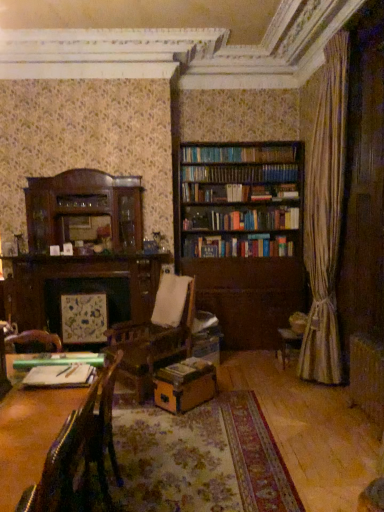
This screenshot has height=512, width=384. What do you see at coordinates (184, 385) in the screenshot?
I see `brown cardboard box at center` at bounding box center [184, 385].

Describe the element at coordinates (79, 455) in the screenshot. I see `leather-like dark brown chair at lower left, which is the 2th chair from front to back` at that location.

Image resolution: width=384 pixels, height=512 pixels. What do you see at coordinates (244, 234) in the screenshot?
I see `brown wooden bookcase at center` at bounding box center [244, 234].

This screenshot has width=384, height=512. Describe the element at coordinates (185, 371) in the screenshot. I see `wooden book at center, which is the second book from left to right` at that location.

Where is `wooden book at center, which ranks as the 2th book in front-to-back order`? This screenshot has width=384, height=512. wooden book at center, which ranks as the 2th book in front-to-back order is located at coordinates (185, 371).

Locate an element on the screen. leather cushioned chair at lower left, which ranks as the first chair in front-to-back order is located at coordinates pos(53,472).

The image size is (384, 512). What do you see at coordinates (53, 472) in the screenshot?
I see `leather cushioned chair at lower left, the second chair in the back-to-front sequence` at bounding box center [53, 472].

This screenshot has width=384, height=512. I want to click on brown cardboard box at center, so click(x=184, y=385).

Which object is thinner, green matte ruler at lower left, which is the second book in bottom-to-top order, or brown cardboard box at center?

With smaller width is green matte ruler at lower left, which is the second book in bottom-to-top order.

Does green matte ruler at lower left, marked as the 1th book in a left-to-right arrangement, appear on the left side of brown cardboard box at center?

Yes, green matte ruler at lower left, marked as the 1th book in a left-to-right arrangement, is to the left of brown cardboard box at center.

Is the depth of green matte ruler at lower left, the first book from the front, greater than that of brown cardboard box at center?

No.

Is brown cardboard box at center at the back of green matte ruler at lower left, positioned as the first book in top-to-bottom order?

That's not correct — green matte ruler at lower left, positioned as the first book in top-to-bottom order, is not looking away from brown cardboard box at center.

Relative to brown cardboard box at center, is wooden book at center, which is the first book from right to left, in front or behind?

In the image, wooden book at center, which is the first book from right to left, appears behind brown cardboard box at center.

Does wooden book at center, which ranks as the 2th book in front-to-back order, turn towards brown cardboard box at center?

No.

Between wooden book at center, which ranks as the 2th book in front-to-back order, and brown cardboard box at center, which one has smaller width?

With smaller width is wooden book at center, which ranks as the 2th book in front-to-back order.

From the image's perspective, relative to brown cardboard box at center, is wooden book at center, which appears as the 1th book when viewed from the back, above or below?

Based on their image positions, wooden book at center, which appears as the 1th book when viewed from the back, is located above brown cardboard box at center.

Can you confirm if brown wooden bookcase at center is positioned to the left of brown cardboard box at center?

In fact, brown wooden bookcase at center is to the right of brown cardboard box at center.

Considering the relative positions of brown wooden bookcase at center and brown cardboard box at center in the image provided, is brown wooden bookcase at center behind brown cardboard box at center?

Yes.

In the scene shown: Considering the sizes of objects brown wooden bookcase at center and brown cardboard box at center in the image provided, who is wider, brown wooden bookcase at center or brown cardboard box at center?

Wider between the two is brown wooden bookcase at center.

Is wooden book at center, which is the first book in bottom-to-top order, positioned with its back to brown wooden bookcase at center?

Yes.

Which object is thinner, wooden book at center, which appears as the 1th book when viewed from the back, or brown wooden bookcase at center?

Thinner between the two is wooden book at center, which appears as the 1th book when viewed from the back.

What's the angular difference between wooden book at center, which ranks as the 2th book in front-to-back order, and brown wooden bookcase at center's facing directions?

The angular difference between wooden book at center, which ranks as the 2th book in front-to-back order, and brown wooden bookcase at center is 45.6 degrees.

From a real-world perspective, is wooden book at center, the 2th book when ordered from top to bottom, physically above brown wooden bookcase at center?

Actually, wooden book at center, the 2th book when ordered from top to bottom, is physically below brown wooden bookcase at center in the real world.

From a real-world perspective, is brown wooden bookcase at center on green matte ruler at lower left, which is the second book in bottom-to-top order?

Correct, in the physical world, brown wooden bookcase at center is higher than green matte ruler at lower left, which is the second book in bottom-to-top order.

Considering the relative positions of brown wooden bookcase at center and green matte ruler at lower left, which is the second book in bottom-to-top order, in the image provided, is brown wooden bookcase at center behind green matte ruler at lower left, which is the second book in bottom-to-top order,?

Yes, brown wooden bookcase at center is behind green matte ruler at lower left, which is the second book in bottom-to-top order.

Which is closer, (x=230, y=221) or (x=50, y=374)?

Clearly, point (x=230, y=221) is more distant from the camera than point (x=50, y=374).

Can you tell me how much brown cardboard box at center and brown wooden bookcase at center differ in facing direction?

The facing directions of brown cardboard box at center and brown wooden bookcase at center are 44.1 degrees apart.

Find the location of a particular element. The image size is (384, 512). bookcase located behind the brown cardboard box at center is located at coordinates (244, 234).

Is the surface of brown cardboard box at center in direct contact with brown wooden bookcase at center?

No.

Is the depth of brown cardboard box at center less than that of brown wooden bookcase at center?

That is True.

Is brown wooden bookcase at center not near wooden book at center, which ranks as the 2th book in front-to-back order?

Absolutely, brown wooden bookcase at center is distant from wooden book at center, which ranks as the 2th book in front-to-back order.

Is brown wooden bookcase at center looking in the opposite direction of wooden book at center, the 2th book when ordered from top to bottom?

brown wooden bookcase at center does not have its back to wooden book at center, the 2th book when ordered from top to bottom.

Considering the positions of points (304, 289) and (205, 368), is point (304, 289) closer to camera compared to point (205, 368)?

No.

Based on the photo, from the image's perspective, between brown wooden bookcase at center and wooden book at center, which is the second book from left to right, who is located below?

wooden book at center, which is the second book from left to right.

The width and height of the screenshot is (384, 512). What are the coordinates of `the 2nd book above the brown cardboard box at center (from the image's perspective)` in the screenshot? It's located at (60, 376).

You are a GUI agent. You are given a task and a screenshot of the screen. Output one action in this format:
    pyautogui.click(x=<x>, y=<y>)
    Task: Click on the book that is the 1st one when counting leftward from the brown cardboard box at center
    This screenshot has height=512, width=384.
    Given the screenshot: What is the action you would take?
    pyautogui.click(x=185, y=371)

Which object lies nearer to the anchor point brown wooden bookcase at center, leather cushioned chair at lower left, which ranks as the first chair in front-to-back order, or leather-like dark brown chair at lower left, which is the 2th chair from front to back?

leather-like dark brown chair at lower left, which is the 2th chair from front to back, is closer to brown wooden bookcase at center.

From the image, which object appears to be farther from wooden book at center, which is the second book from left to right, green matte ruler at lower left, marked as the 1th book in a left-to-right arrangement, or leather-like dark brown chair at lower left, which is the 2th chair from front to back?

green matte ruler at lower left, marked as the 1th book in a left-to-right arrangement, lies further to wooden book at center, which is the second book from left to right, than the other object.

From the image, which object appears to be nearer to leather-like dark brown chair at lower left, the first chair positioned from the back, green matte ruler at lower left, which is the 2th book from back to front, or brown cardboard box at center?

green matte ruler at lower left, which is the 2th book from back to front, is closer to leather-like dark brown chair at lower left, the first chair positioned from the back.

Which object lies nearer to the anchor point leather cushioned chair at lower left, which ranks as the first chair in front-to-back order, green matte ruler at lower left, marked as the 1th book in a left-to-right arrangement, or leather-like dark brown chair at lower left, which is the 2th chair from front to back?

Based on the image, leather-like dark brown chair at lower left, which is the 2th chair from front to back, appears to be nearer to leather cushioned chair at lower left, which ranks as the first chair in front-to-back order.

From the image, which object appears to be farther from green matte ruler at lower left, which is the second book in right-to-left order, wooden book at center, which is the first book from right to left, or brown wooden bookcase at center?

The object further to green matte ruler at lower left, which is the second book in right-to-left order, is brown wooden bookcase at center.

From the image, which object appears to be farther from leather cushioned chair at lower left, the second chair in the back-to-front sequence, wooden book at center, which appears as the 1th book when viewed from the back, or brown wooden bookcase at center?

brown wooden bookcase at center is positioned further to the anchor leather cushioned chair at lower left, the second chair in the back-to-front sequence.

From the image, which object appears to be farther from green matte ruler at lower left, the first book from the front, leather cushioned chair at lower left, which ranks as the first chair in front-to-back order, or brown wooden bookcase at center?

brown wooden bookcase at center.

Considering their positions, is brown cardboard box at center positioned closer to leather-like dark brown chair at lower left, which is the 2th chair from front to back, than leather cushioned chair at lower left, which ranks as the first chair in front-to-back order?

leather cushioned chair at lower left, which ranks as the first chair in front-to-back order, lies closer to leather-like dark brown chair at lower left, which is the 2th chair from front to back, than the other object.

This screenshot has width=384, height=512. I want to click on chair between leather cushioned chair at lower left, the second chair in the back-to-front sequence, and brown cardboard box at center, along the z-axis, so click(79, 455).

At what (x,y) coordinates should I click in order to perform the action: click on book located between brown cardboard box at center and brown wooden bookcase at center in the depth direction. Please return your answer as a coordinate pair (x, y). This screenshot has width=384, height=512. Looking at the image, I should click on (185, 371).

Find the location of a particular element. chair located between leather cushioned chair at lower left, which ranks as the first chair in front-to-back order, and wooden book at center, which ranks as the 2th book in front-to-back order, in the depth direction is located at coordinates (79, 455).

Locate an element on the screen. This screenshot has width=384, height=512. cardboard box between leather-like dark brown chair at lower left, the first chair positioned from the back, and brown wooden bookcase at center from front to back is located at coordinates (184, 385).